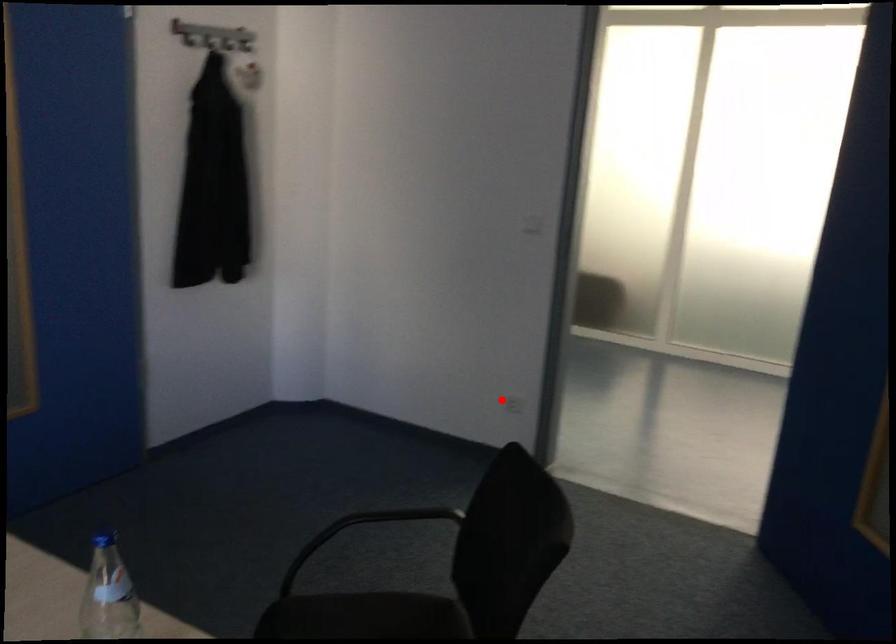
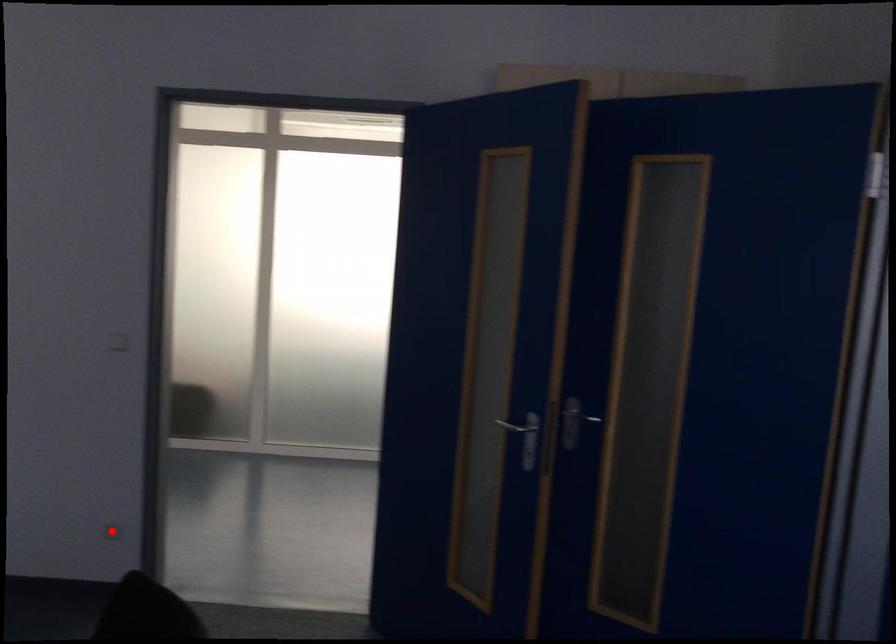
From the picture: I am providing you with two images of the same scene from different viewpoints. A red point is marked on the first image and another point is marked on the second image. Are the points marked in image1 and image2 representing the same 3D position?

Yes